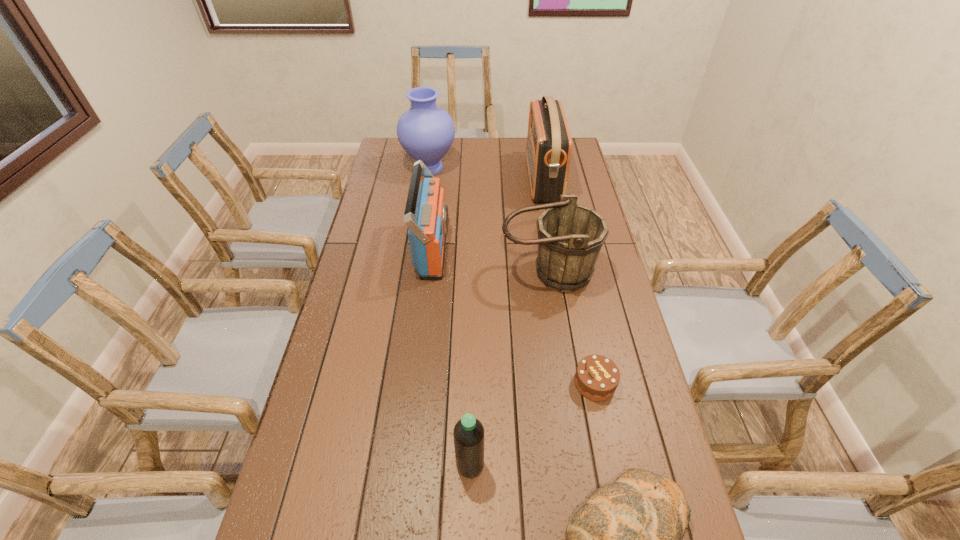
Find the location of a particular element. radio receiver situated at the right edge is located at coordinates (548, 150).

Image resolution: width=960 pixels, height=540 pixels. In order to click on bucket situated at the right edge in this screenshot , I will do `click(570, 236)`.

Where is `chocolate cake that is at the right edge`? Image resolution: width=960 pixels, height=540 pixels. chocolate cake that is at the right edge is located at coordinates coord(597,377).

You are a GUI agent. You are given a task and a screenshot of the screen. Output one action in this format:
    pyautogui.click(x=<x>, y=<y>)
    Task: Click on the object positioned at the far left corner
    
    Given the screenshot: What is the action you would take?
    pyautogui.click(x=426, y=132)

I want to click on object located in the far right corner section of the desktop, so (x=548, y=150).

In the image, there is a desktop. Where is `free space at the far edge`? free space at the far edge is located at coordinates (512, 159).

The height and width of the screenshot is (540, 960). I want to click on vacant space at the left edge of the desktop, so click(x=396, y=200).

You are a GUI agent. You are given a task and a screenshot of the screen. Output one action in this format:
    pyautogui.click(x=<x>, y=<y>)
    Task: Click on the vacant region at the right edge of the desktop
    
    Given the screenshot: What is the action you would take?
    pyautogui.click(x=645, y=439)

This screenshot has height=540, width=960. In the image, there is a desktop. Identify the location of vacant region at the far left corner. (388, 138).

Image resolution: width=960 pixels, height=540 pixels. I want to click on free spot between the bucket and the vase, so click(489, 221).